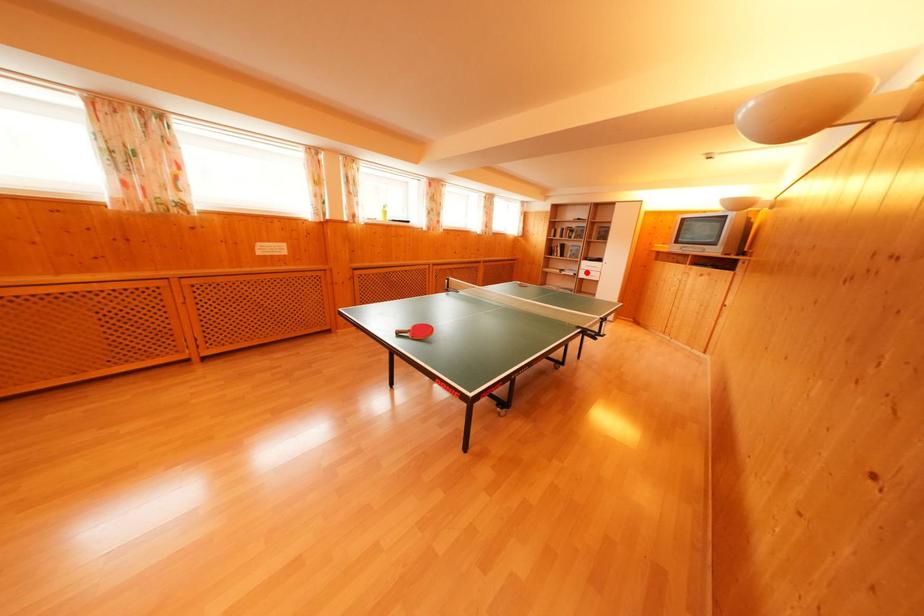
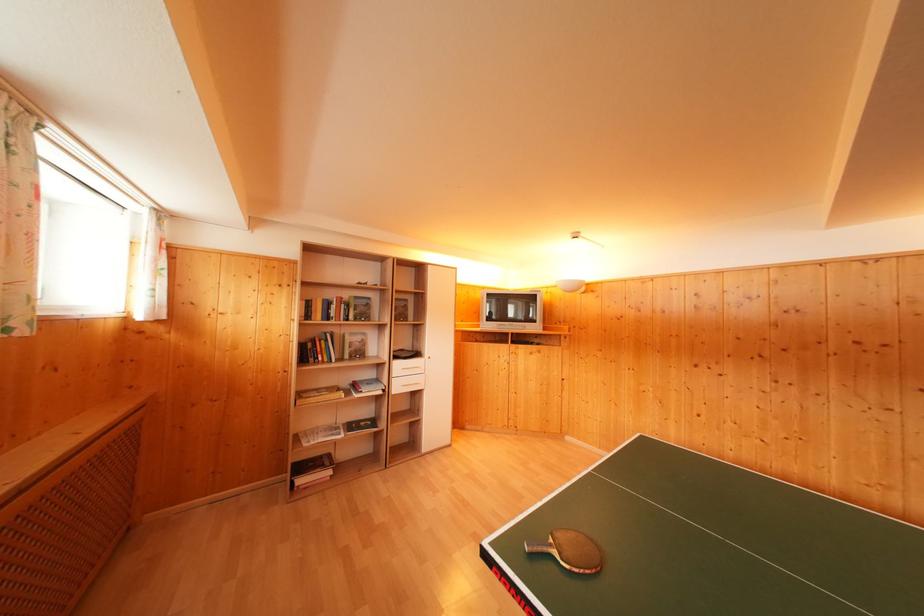
Question: I am providing you with two images of the same scene from different viewpoints. In image1, a red point is highlighted. Considering the same 3D point in image2, which of the following is correct?

Choices:
 (A) It is closer
 (B) It is farther

Answer: (B)